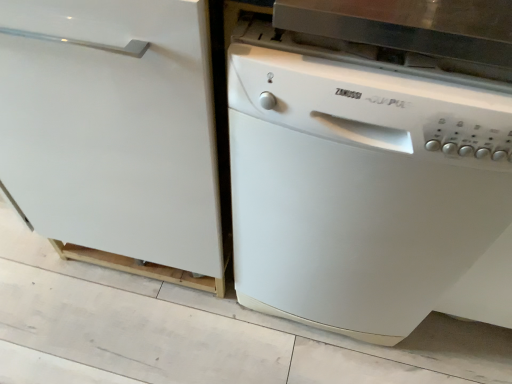
Question: Does white matte dishwasher at right lie in front of white matte dishwasher at right?

Choices:
 (A) no
 (B) yes

Answer: (A)

Question: Is white matte dishwasher at right aimed at white matte dishwasher at right?

Choices:
 (A) no
 (B) yes

Answer: (A)

Question: Is white matte dishwasher at right further to camera compared to white matte dishwasher at right?

Choices:
 (A) no
 (B) yes

Answer: (B)

Question: Is white matte dishwasher at right at the back of white matte dishwasher at right?

Choices:
 (A) no
 (B) yes

Answer: (A)

Question: From a real-world perspective, is white matte dishwasher at right positioned over white matte dishwasher at right based on gravity?

Choices:
 (A) no
 (B) yes

Answer: (B)

Question: Can you see white matte dishwasher at right touching white matte dishwasher at right?

Choices:
 (A) no
 (B) yes

Answer: (A)

Question: From the image's perspective, would you say white matte dishwasher at right is positioned over white matte dishwasher at right?

Choices:
 (A) no
 (B) yes

Answer: (A)

Question: Does white matte dishwasher at right appear on the left side of white matte dishwasher at right?

Choices:
 (A) yes
 (B) no

Answer: (B)

Question: Is the position of white matte dishwasher at right less distant than that of white matte dishwasher at right?

Choices:
 (A) no
 (B) yes

Answer: (B)

Question: Is the position of white matte dishwasher at right more distant than that of white matte dishwasher at right?

Choices:
 (A) yes
 (B) no

Answer: (B)

Question: From the image's perspective, is white matte dishwasher at right under white matte dishwasher at right?

Choices:
 (A) yes
 (B) no

Answer: (A)

Question: Does white matte dishwasher at right have a greater width compared to white matte dishwasher at right?

Choices:
 (A) no
 (B) yes

Answer: (A)

Question: From a real-world perspective, relative to white matte dishwasher at right, is white matte dishwasher at right vertically above or below?

Choices:
 (A) below
 (B) above

Answer: (B)